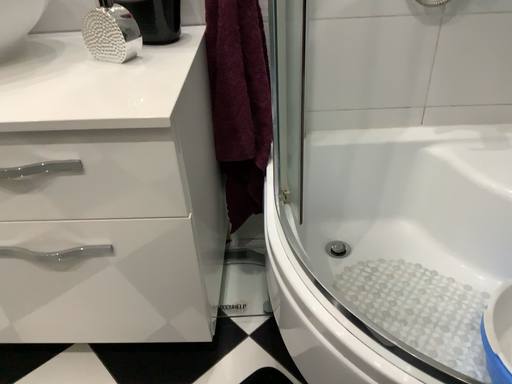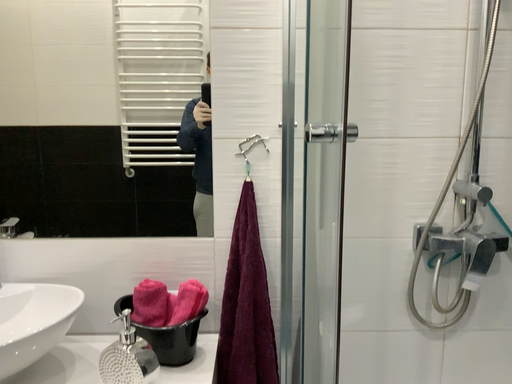
Question: Which way did the camera rotate in the video?

Choices:
 (A) rotated upward
 (B) rotated downward

Answer: (A)